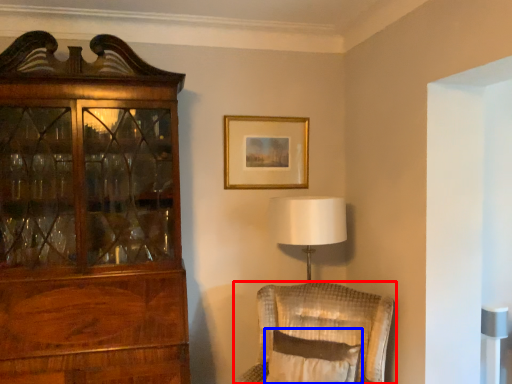
Question: Which object is closer to the camera taking this photo, chair (highlighted by a red box) or pillow (highlighted by a blue box)?

Choices:
 (A) chair
 (B) pillow

Answer: (B)